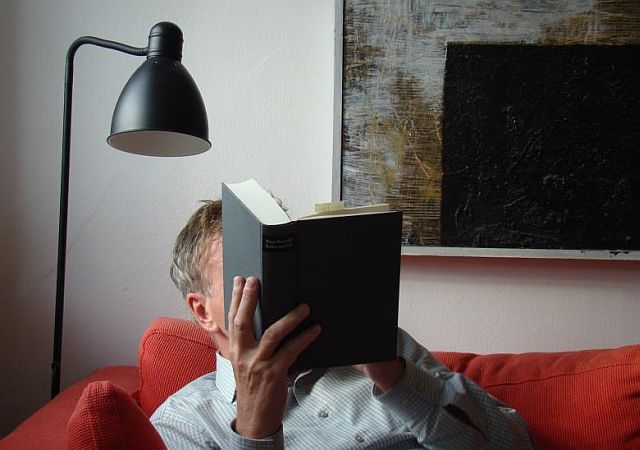
Identify the location of wall. This screenshot has width=640, height=450. (284, 102).